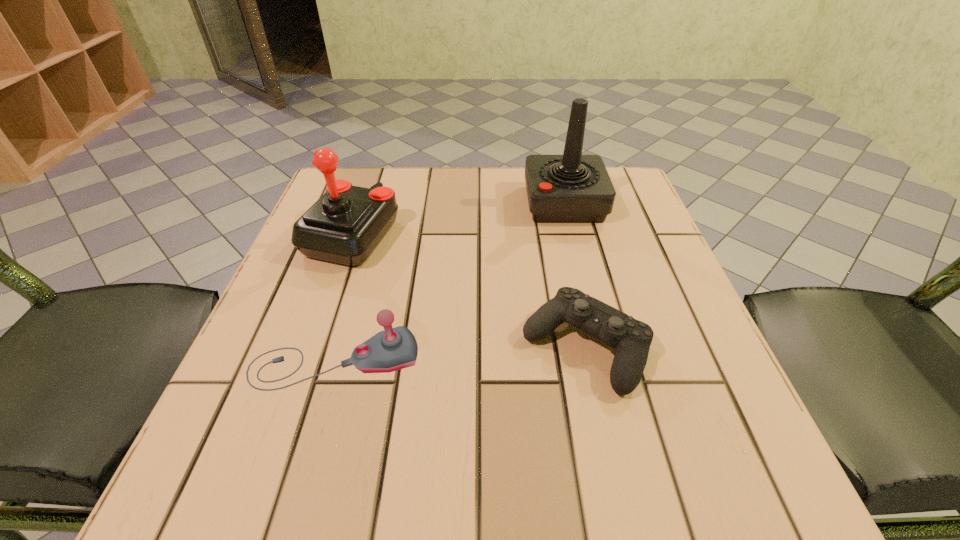
The width and height of the screenshot is (960, 540). Identify the location of the rightmost joystick. (571, 188).

The image size is (960, 540). I want to click on the shortest joystick, so click(x=393, y=349).

Locate an element on the screen. The height and width of the screenshot is (540, 960). the nearest joystick is located at coordinates (393, 349).

Image resolution: width=960 pixels, height=540 pixels. I want to click on the shortest object, so click(631, 339).

Find the location of a particular element. The image size is (960, 540). vacant space located 0.280m on the front-facing side of the rightmost joystick is located at coordinates (406, 203).

The width and height of the screenshot is (960, 540). I want to click on vacant space located on the front-facing side of the rightmost joystick, so click(375, 203).

Identify the location of blank space located 0.230m on the front-facing side of the rightmost joystick. Image resolution: width=960 pixels, height=540 pixels. (427, 203).

Where is `blank space located 0.260m on the back of the second shortest object`? The width and height of the screenshot is (960, 540). blank space located 0.260m on the back of the second shortest object is located at coordinates (371, 238).

Locate an element on the screen. vacant space located 0.200m on the left of the control is located at coordinates (400, 347).

The image size is (960, 540). I want to click on joystick present at the right edge, so click(571, 188).